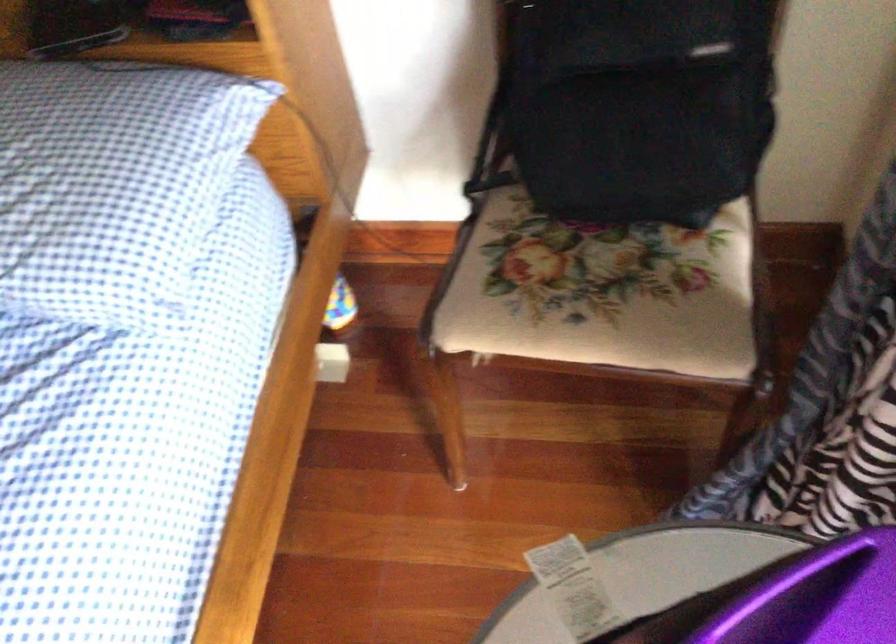
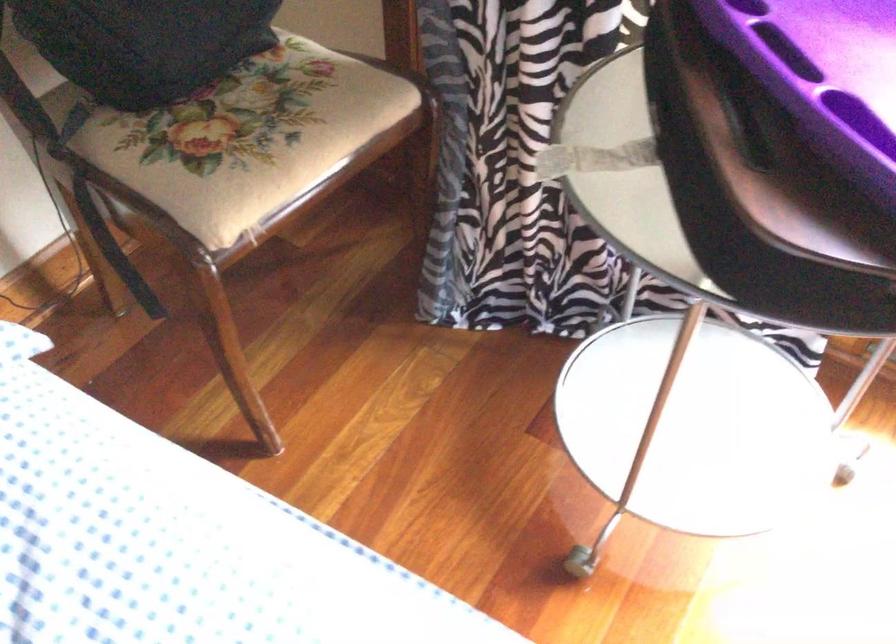
Locate, in the second image, the point that corresponds to the point at 547,303 in the first image.

(259, 145)